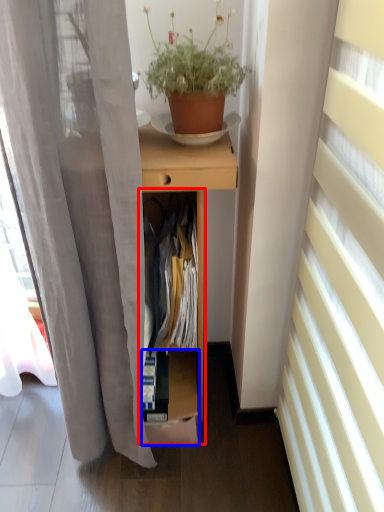
Question: Which of the following is the closest to the observer, cabinet (highlighted by a red box) or shelf (highlighted by a blue box)?

Choices:
 (A) cabinet
 (B) shelf

Answer: (A)